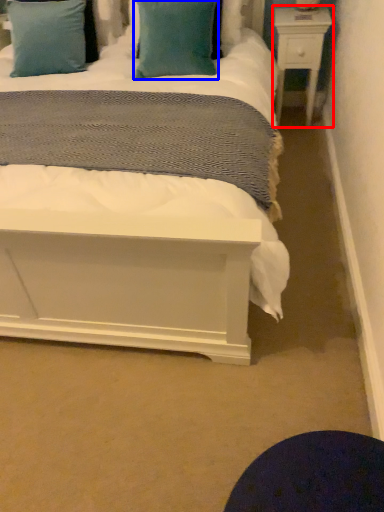
Question: Which object appears closest to the camera in this image, nightstand (highlighted by a red box) or pillow (highlighted by a blue box)?

Choices:
 (A) nightstand
 (B) pillow

Answer: (B)